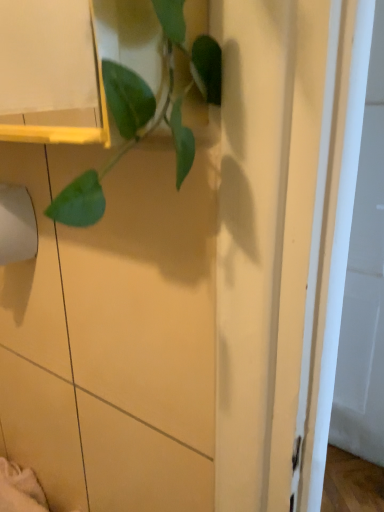
Question: Considering the relative positions of green leafy plant at upper left and white matte toilet paper at left in the image provided, is green leafy plant at upper left to the right of white matte toilet paper at left from the viewer's perspective?

Choices:
 (A) yes
 (B) no

Answer: (A)

Question: Is green leafy plant at upper left touching white matte toilet paper at left?

Choices:
 (A) yes
 (B) no

Answer: (B)

Question: From the image's perspective, would you say green leafy plant at upper left is positioned over white matte toilet paper at left?

Choices:
 (A) no
 (B) yes

Answer: (B)

Question: Does green leafy plant at upper left come behind white matte toilet paper at left?

Choices:
 (A) yes
 (B) no

Answer: (B)

Question: From a real-world perspective, is green leafy plant at upper left positioned under white matte toilet paper at left based on gravity?

Choices:
 (A) yes
 (B) no

Answer: (B)

Question: Does green leafy plant at upper left have a greater width compared to white matte toilet paper at left?

Choices:
 (A) yes
 (B) no

Answer: (B)

Question: From a real-world perspective, is white matte toilet paper at left positioned under green leafy plant at upper left based on gravity?

Choices:
 (A) yes
 (B) no

Answer: (A)

Question: Is white matte toilet paper at left outside green leafy plant at upper left?

Choices:
 (A) no
 (B) yes

Answer: (B)

Question: From the image's perspective, is white matte toilet paper at left beneath green leafy plant at upper left?

Choices:
 (A) no
 (B) yes

Answer: (B)

Question: Is white matte toilet paper at left oriented towards green leafy plant at upper left?

Choices:
 (A) no
 (B) yes

Answer: (A)

Question: Does white matte toilet paper at left have a greater width compared to green leafy plant at upper left?

Choices:
 (A) no
 (B) yes

Answer: (B)

Question: Is the surface of white matte toilet paper at left in direct contact with green leafy plant at upper left?

Choices:
 (A) yes
 (B) no

Answer: (B)

Question: Looking at their shapes, would you say white matte toilet paper at left is wider or thinner than green leafy plant at upper left?

Choices:
 (A) thin
 (B) wide

Answer: (B)